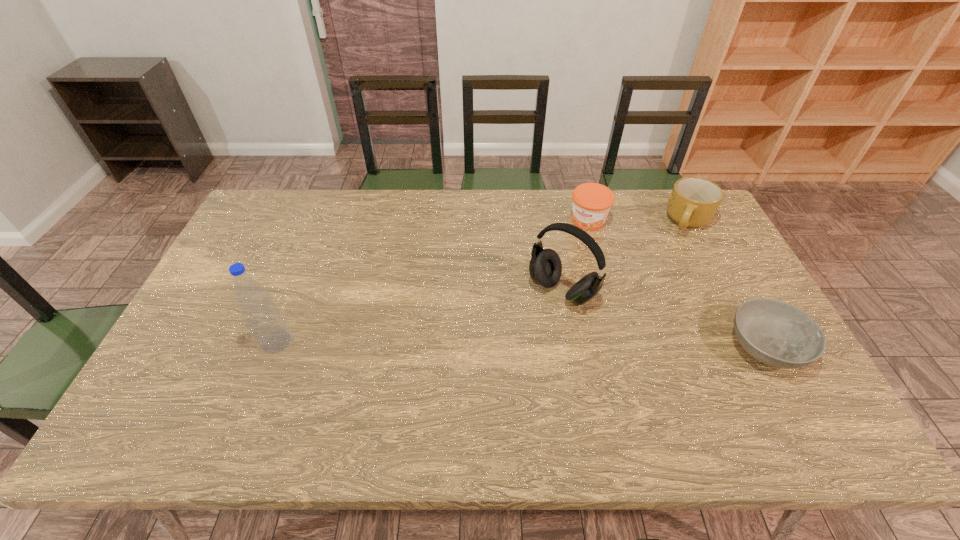
Where is `vacant space located on the ear cups of the second tallest object`? The height and width of the screenshot is (540, 960). vacant space located on the ear cups of the second tallest object is located at coordinates (501, 354).

Find the location of a particular element. vacant space located 0.120m on the front label of the jam is located at coordinates (564, 252).

What are the coordinates of `vacant region located on the front label of the jam` in the screenshot? It's located at (528, 299).

This screenshot has height=540, width=960. I want to click on free location located on the front label of the jam, so pyautogui.click(x=563, y=254).

Identify the location of vacant area situated on the side with the handle of the mug. (657, 259).

Locate an element on the screen. Image resolution: width=960 pixels, height=540 pixels. vacant space located on the side with the handle of the mug is located at coordinates (649, 267).

Find the location of `free location located on the side with the handle of the mug`. free location located on the side with the handle of the mug is located at coordinates (638, 278).

Find the location of a particular element. Image resolution: width=960 pixels, height=540 pixels. jam located in the far edge section of the desktop is located at coordinates (591, 202).

Identify the location of mug situated at the far edge. (693, 203).

Where is `object present at the near edge`? object present at the near edge is located at coordinates click(776, 333).